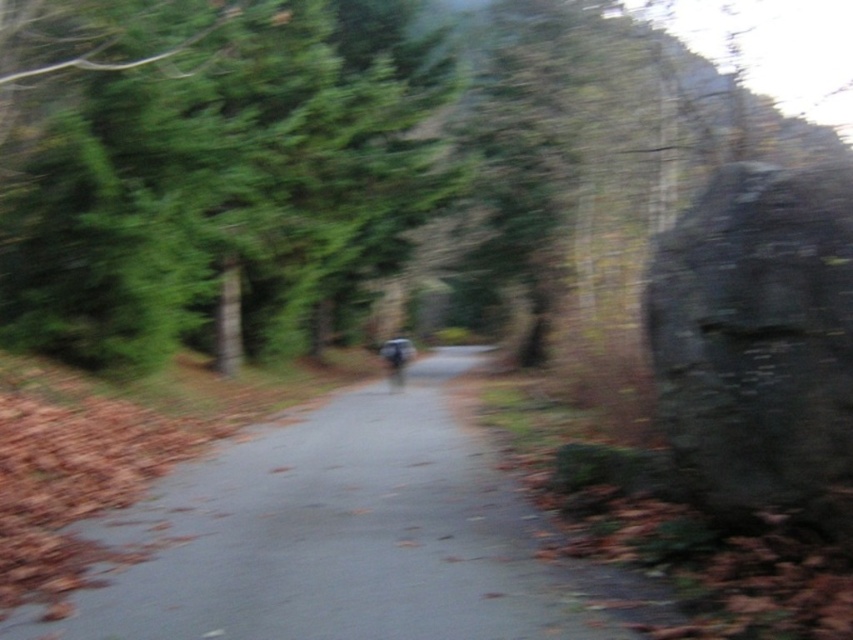
Which is behind, point (163, 577) or point (788, 195)?

Positioned behind is point (163, 577).

Who is positioned more to the left, smooth asphalt trail at center or dark gray stone boulder at right?

From the viewer's perspective, smooth asphalt trail at center appears more on the left side.

Is point (224, 556) closer to camera compared to point (840, 241)?

That is False.

This screenshot has width=853, height=640. Find the location of `smooth asphalt trail at center`. smooth asphalt trail at center is located at coordinates (347, 538).

Measure the distance between green leafy tree at upper left and smooth asphalt trail at center.

green leafy tree at upper left and smooth asphalt trail at center are 5.20 meters apart from each other.

Between green leafy tree at upper left and smooth asphalt trail at center, which one appears on the left side from the viewer's perspective?

From the viewer's perspective, green leafy tree at upper left appears more on the left side.

Which is behind, point (108, 272) or point (640, 592)?

Point (108, 272)

Locate an element on the screen. Image resolution: width=853 pixels, height=640 pixels. green leafy tree at upper left is located at coordinates (219, 177).

Is smooth asphalt trail at center smaller than metallic silver motorcycle at center?

Indeed, smooth asphalt trail at center has a smaller size compared to metallic silver motorcycle at center.

Is smooth asphalt trail at center shorter than metallic silver motorcycle at center?

Yes.

Is point (630, 588) positioned in front of point (389, 358)?

Yes, it is.

This screenshot has height=640, width=853. What are the coordinates of `smooth asphalt trail at center` in the screenshot? It's located at (347, 538).